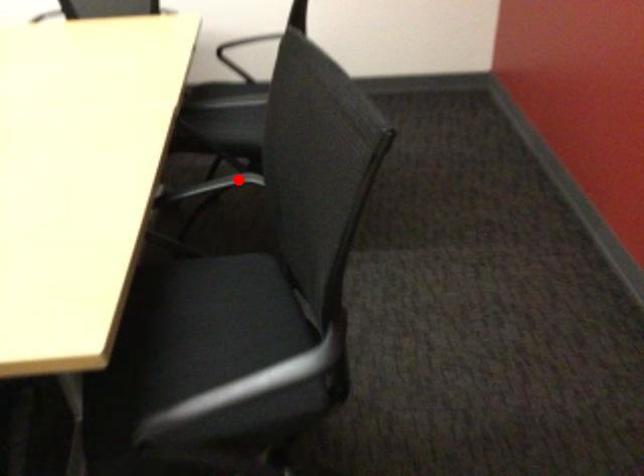
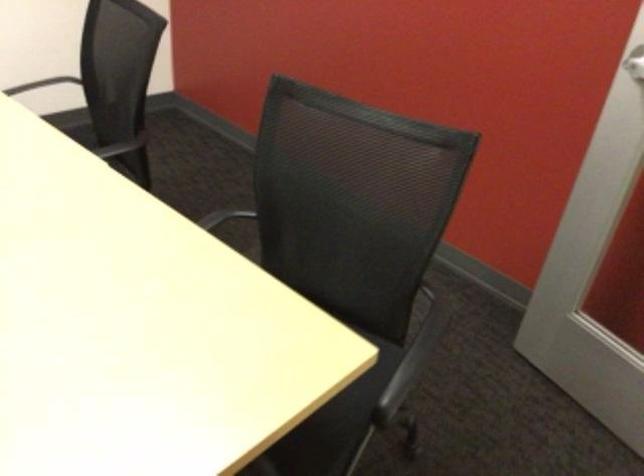
Where in the second image is the point corresponding to the highlighted location from the first image?

(223, 217)